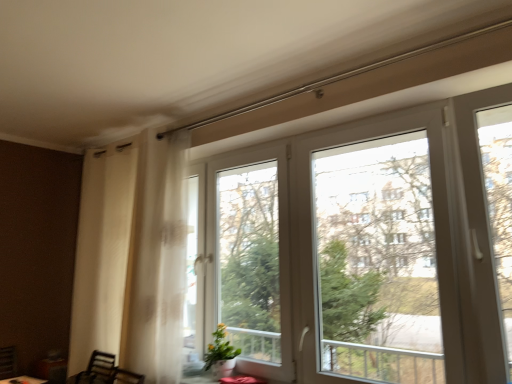
The image size is (512, 384). What are the coordinates of `transparent plastic window at upper center, placed as the first window screen when sorted from right to left` in the screenshot? It's located at (377, 261).

In order to face matte brown round table at lower left, should I rotate leftwards or rightwards?

Rotate left and turn 28.607 degrees.

At what (x,y) coordinates should I click in order to perform the action: click on transparent glass window at center, which is the second window screen in right-to-left order. Please return your answer as a coordinate pair (x, y). The height and width of the screenshot is (384, 512). Looking at the image, I should click on (250, 259).

This screenshot has height=384, width=512. I want to click on transparent plastic window at upper center, placed as the first window screen when sorted from right to left, so click(x=377, y=261).

Is yellow-green leafy plant at lower center surrounded by transparent plastic window at upper center, placed as the first window screen when sorted from right to left?

No.

From a real-world perspective, which window screen is the 2nd one above the yellow-green leafy plant at lower center? Please provide its 2D coordinates.

[(377, 261)]

Can you confirm if transparent plastic window at upper center, placed as the first window screen when sorted from right to left, is bigger than yellow-green leafy plant at lower center?

Indeed, transparent plastic window at upper center, placed as the first window screen when sorted from right to left, has a larger size compared to yellow-green leafy plant at lower center.

Does transparent plastic window at upper center, arranged as the second window screen when viewed from the left, have a greater width compared to yellow-green leafy plant at lower center?

No, transparent plastic window at upper center, arranged as the second window screen when viewed from the left, is not wider than yellow-green leafy plant at lower center.

Is matte brown round table at lower left directly adjacent to transparent plastic window at upper center, arranged as the second window screen when viewed from the left?

There is a gap between matte brown round table at lower left and transparent plastic window at upper center, arranged as the second window screen when viewed from the left.

I want to click on the 2nd window screen above the matte brown round table at lower left (from the image's perspective), so click(x=377, y=261).

From a real-world perspective, who is located lower, matte brown round table at lower left or transparent plastic window at upper center, arranged as the second window screen when viewed from the left?

matte brown round table at lower left, from a real-world perspective.

Is transparent glass window at center, which is the second window screen in right-to-left order, further to the viewer compared to matte brown round table at lower left?

No, transparent glass window at center, which is the second window screen in right-to-left order, is closer to the camera.

Is transparent glass window at center, the 1th window screen viewed from the left, taller or shorter than matte brown round table at lower left?

Considering their sizes, transparent glass window at center, the 1th window screen viewed from the left, has more height than matte brown round table at lower left.

Which is nearer, (264, 350) or (0, 380)?

The point (264, 350) is closer.

How many degrees apart are the facing directions of matte brown round table at lower left and matte red table at lower center?

The angular difference between matte brown round table at lower left and matte red table at lower center is 102 degrees.

Can we say matte brown round table at lower left lies outside matte red table at lower center?

Yes.

Measure the distance between matte brown round table at lower left and matte red table at lower center.

matte brown round table at lower left is 1.62 meters from matte red table at lower center.

Based on their sizes in the image, would you say matte brown round table at lower left is bigger or smaller than matte red table at lower center?

Clearly, matte brown round table at lower left is larger in size than matte red table at lower center.

Considering the positions of point (219, 346) and point (232, 380), is point (219, 346) closer or farther from the camera than point (232, 380)?

Clearly, point (219, 346) is more distant from the camera than point (232, 380).

Can you tell me how much yellow-green leafy plant at lower center and matte red table at lower center differ in facing direction?

There is a 7.05e-05-degree angle between the facing directions of yellow-green leafy plant at lower center and matte red table at lower center.

Is yellow-green leafy plant at lower center facing towards matte red table at lower center?

No.

In the image, is yellow-green leafy plant at lower center on the left side or the right side of matte red table at lower center?

yellow-green leafy plant at lower center is to the left of matte red table at lower center.

Is yellow-green leafy plant at lower center completely or partially outside of transparent plastic window at upper center, arranged as the second window screen when viewed from the left?

Absolutely, yellow-green leafy plant at lower center is external to transparent plastic window at upper center, arranged as the second window screen when viewed from the left.

Is yellow-green leafy plant at lower center aimed at transparent plastic window at upper center, placed as the first window screen when sorted from right to left?

No.

Between yellow-green leafy plant at lower center and transparent plastic window at upper center, arranged as the second window screen when viewed from the left, which one has smaller size?

Smaller between the two is yellow-green leafy plant at lower center.

Locate an element on the screen. This screenshot has width=512, height=384. the 2nd window screen in front of the yellow-green leafy plant at lower center is located at coordinates (377, 261).

Can you confirm if transparent plastic window at upper center, placed as the first window screen when sorted from right to left, is bigger than transparent glass window at center, which is the second window screen in right-to-left order?

No.

Consider the image. From a real-world perspective, is transparent plastic window at upper center, placed as the first window screen when sorted from right to left, positioned over transparent glass window at center, which is the second window screen in right-to-left order, based on gravity?

Yes, from a real-world perspective, transparent plastic window at upper center, placed as the first window screen when sorted from right to left, is over transparent glass window at center, which is the second window screen in right-to-left order

Is transparent plastic window at upper center, placed as the first window screen when sorted from right to left, positioned before transparent glass window at center, the 1th window screen viewed from the left?

That is True.

Is point (411, 229) more distant than point (227, 227)?

No, it is not.

From the yellow-green leafy plant at lower center, count 2nd window screens forward and point to it. Please provide its 2D coordinates.

[(377, 261)]

The width and height of the screenshot is (512, 384). I want to click on the 2nd window screen to the right of the matte brown round table at lower left, counting from the anchor's position, so click(377, 261).

When comparing their distances from matte brown round table at lower left, does yellow-green leafy plant at lower center or transparent plastic window at upper center, placed as the first window screen when sorted from right to left, seem further?

Among the two, transparent plastic window at upper center, placed as the first window screen when sorted from right to left, is located further to matte brown round table at lower left.

From the image, which object appears to be nearer to yellow-green leafy plant at lower center, matte brown round table at lower left or transparent plastic window at upper center, placed as the first window screen when sorted from right to left?

Among the two, transparent plastic window at upper center, placed as the first window screen when sorted from right to left, is located nearer to yellow-green leafy plant at lower center.

Based on their spatial positions, is matte red table at lower center or yellow-green leafy plant at lower center further from transparent plastic window at upper center, arranged as the second window screen when viewed from the left?

yellow-green leafy plant at lower center is positioned further to the anchor transparent plastic window at upper center, arranged as the second window screen when viewed from the left.

Estimate the real-world distances between objects in this image. Which object is further from matte red table at lower center, matte brown round table at lower left or transparent plastic window at upper center, placed as the first window screen when sorted from right to left?

Among the two, matte brown round table at lower left is located further to matte red table at lower center.

Considering their positions, is transparent glass window at center, the 1th window screen viewed from the left, positioned further to yellow-green leafy plant at lower center than matte red table at lower center?

Based on the image, transparent glass window at center, the 1th window screen viewed from the left, appears to be further to yellow-green leafy plant at lower center.

Which object lies further to the anchor point matte brown round table at lower left, transparent plastic window at upper center, placed as the first window screen when sorted from right to left, or transparent glass window at center, the 1th window screen viewed from the left?

transparent plastic window at upper center, placed as the first window screen when sorted from right to left, lies further to matte brown round table at lower left than the other object.

When comparing their distances from transparent plastic window at upper center, arranged as the second window screen when viewed from the left, does matte brown round table at lower left or transparent glass window at center, which is the second window screen in right-to-left order, seem closer?

transparent glass window at center, which is the second window screen in right-to-left order.

Looking at the image, which one is located further to transparent plastic window at upper center, arranged as the second window screen when viewed from the left, matte red table at lower center or matte brown round table at lower left?

Based on the image, matte brown round table at lower left appears to be further to transparent plastic window at upper center, arranged as the second window screen when viewed from the left.

Locate an element on the screen. The image size is (512, 384). houseplant between transparent plastic window at upper center, placed as the first window screen when sorted from right to left, and matte red table at lower center, in the vertical direction is located at coordinates (221, 354).

The image size is (512, 384). What are the coordinates of `window screen between matte brown round table at lower left and transparent plastic window at upper center, placed as the first window screen when sorted from right to left, from left to right` in the screenshot? It's located at (250, 259).

Find the location of a particular element. Image resolution: width=512 pixels, height=384 pixels. table between matte brown round table at lower left and transparent glass window at center, which is the second window screen in right-to-left order, from left to right is located at coordinates (242, 380).

Where is `houseplant between matte brown round table at lower left and transparent glass window at center, which is the second window screen in right-to-left order, from left to right`? This screenshot has width=512, height=384. houseplant between matte brown round table at lower left and transparent glass window at center, which is the second window screen in right-to-left order, from left to right is located at coordinates (221, 354).